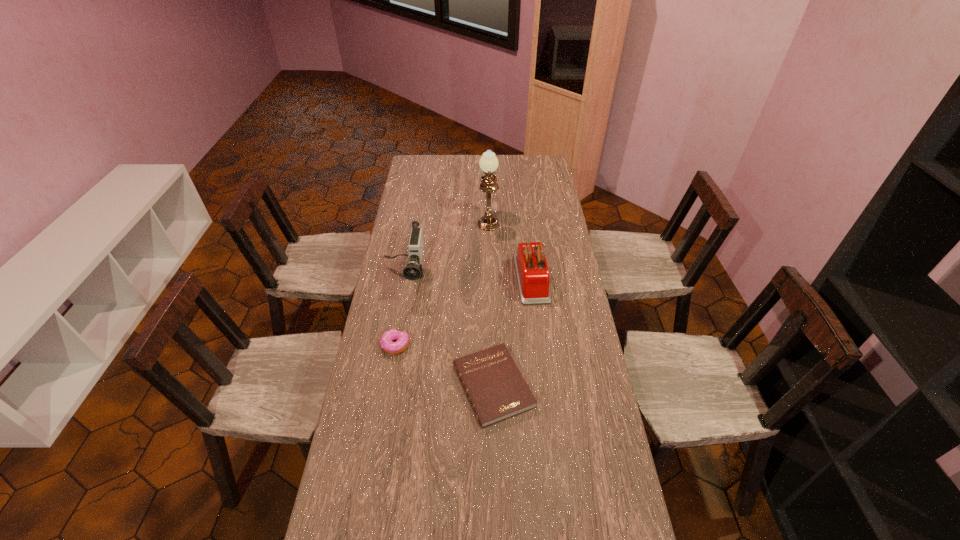
Locate an element on the screen. vacant space that satisfies the following two spatial constraints: 1. on the recording direction of the shortest object; 2. on the right side of the camcorder is located at coordinates (386, 386).

The image size is (960, 540). Find the location of `free point that satisfies the following two spatial constraints: 1. on the recording direction of the hardback book; 2. on the right side of the camcorder`. free point that satisfies the following two spatial constraints: 1. on the recording direction of the hardback book; 2. on the right side of the camcorder is located at coordinates (386, 386).

This screenshot has width=960, height=540. What are the coordinates of `free space that satisfies the following two spatial constraints: 1. on the recording direction of the camcorder; 2. on the left side of the fourth tallest object` in the screenshot? It's located at point(393,345).

Find the location of `free location that satisfies the following two spatial constraints: 1. on the recording direction of the camcorder; 2. on the left side of the shortest object`. free location that satisfies the following two spatial constraints: 1. on the recording direction of the camcorder; 2. on the left side of the shortest object is located at coordinates (386, 386).

Image resolution: width=960 pixels, height=540 pixels. Find the location of `free space that satisfies the following two spatial constraints: 1. on the recording direction of the shortest object; 2. on the left side of the camcorder`. free space that satisfies the following two spatial constraints: 1. on the recording direction of the shortest object; 2. on the left side of the camcorder is located at coordinates (386, 386).

Locate an element on the screen. The height and width of the screenshot is (540, 960). free point that satisfies the following two spatial constraints: 1. on the front side of the shortest object; 2. on the right side of the fourth tallest object is located at coordinates (389, 386).

In order to click on free space that satisfies the following two spatial constraints: 1. on the recording direction of the camcorder; 2. on the right side of the toaster in this screenshot , I will do `click(404, 278)`.